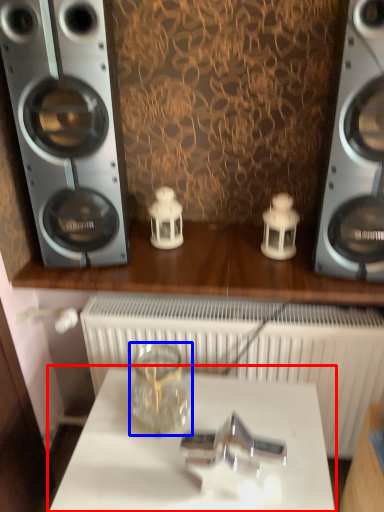
Question: Among these objects, which one is nearest to the camera, table (highlighted by a red box) or glass jar (highlighted by a blue box)?

Choices:
 (A) table
 (B) glass jar

Answer: (A)